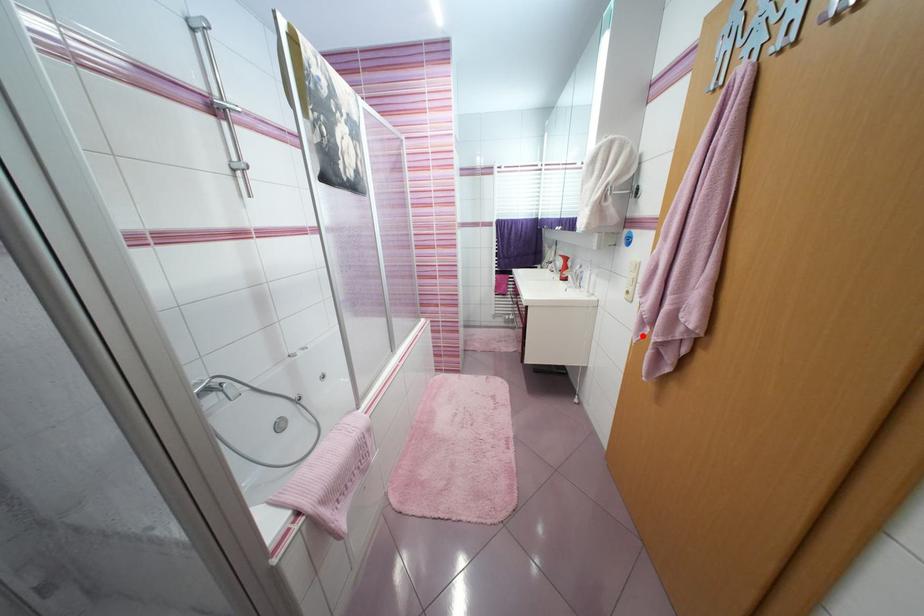
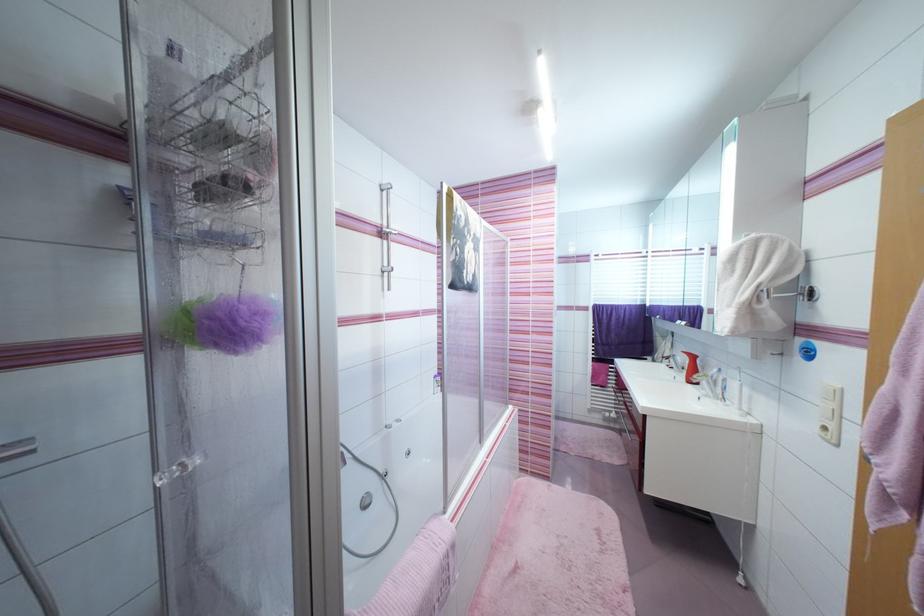
In the second image, find the point that corresponds to the highlighted location in the first image.

(883, 517)